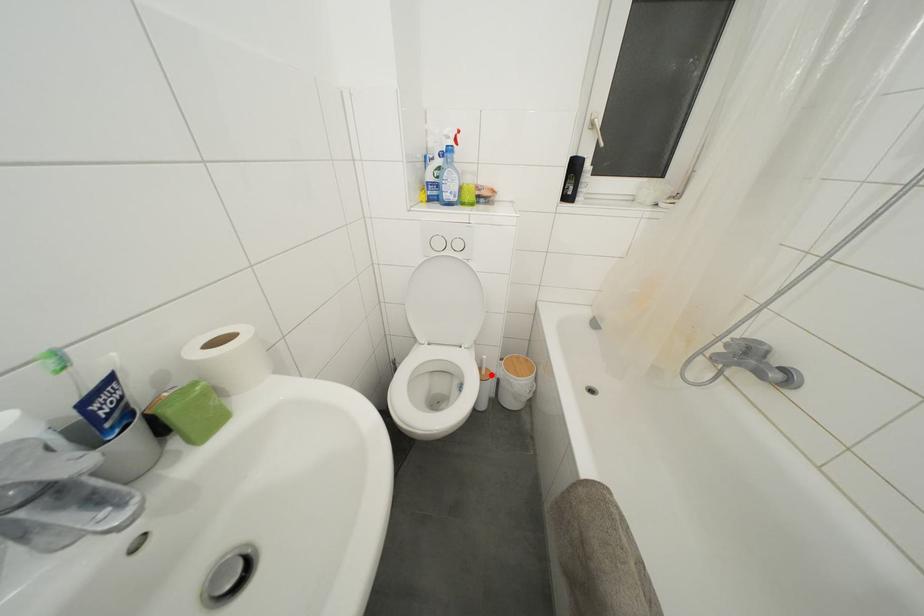
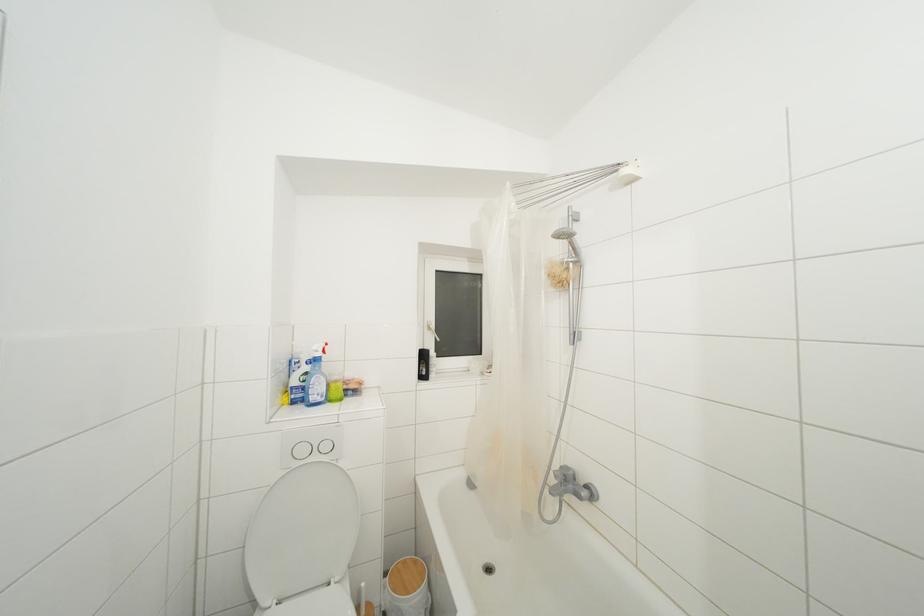
Question: I am providing you with two images of the same scene from different viewpoints. A red point is marked on the first image. At the location where the point appears in image 1, is it still visible in image 2?

Choices:
 (A) Yes
 (B) No

Answer: (A)